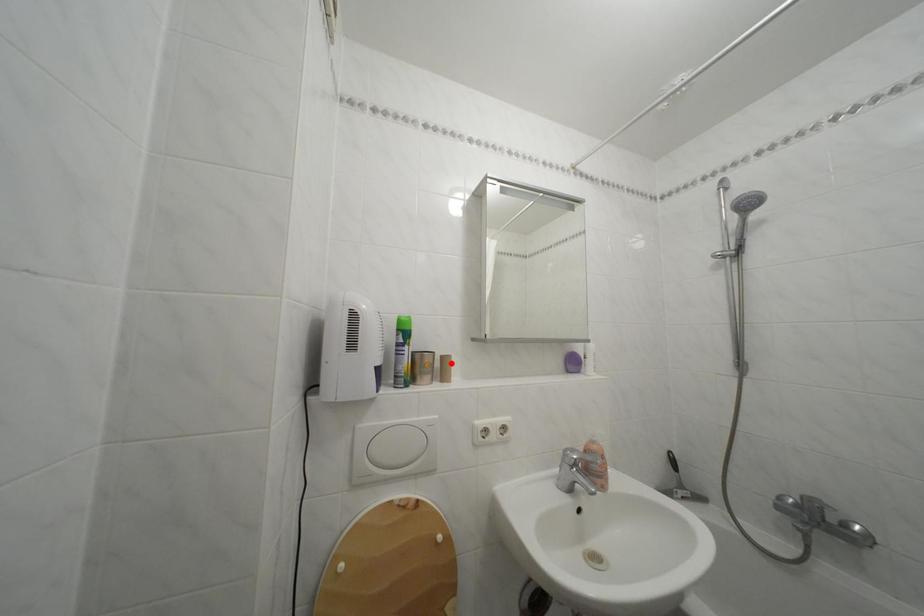
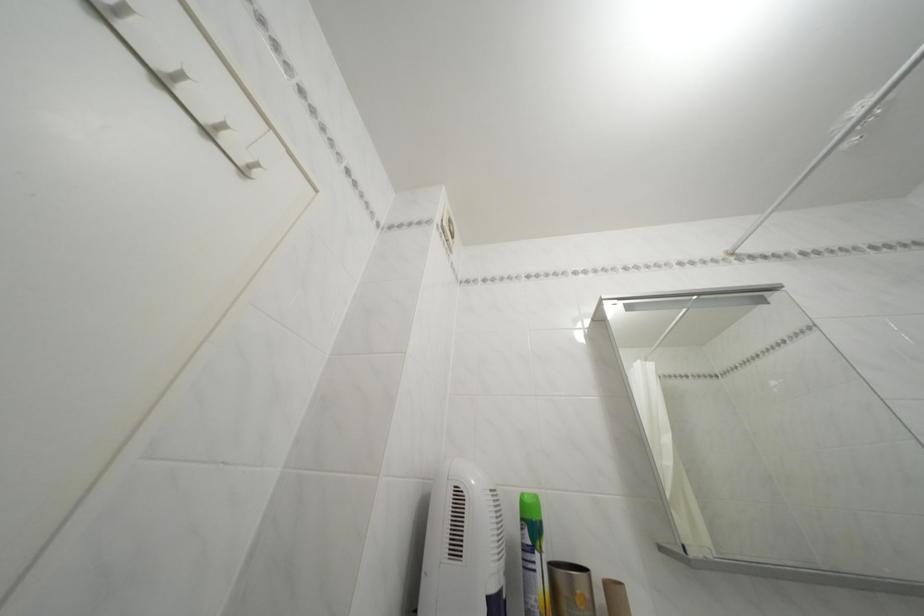
Where in the second image is the point corresponding to the highlighted location from the first image?

(614, 591)